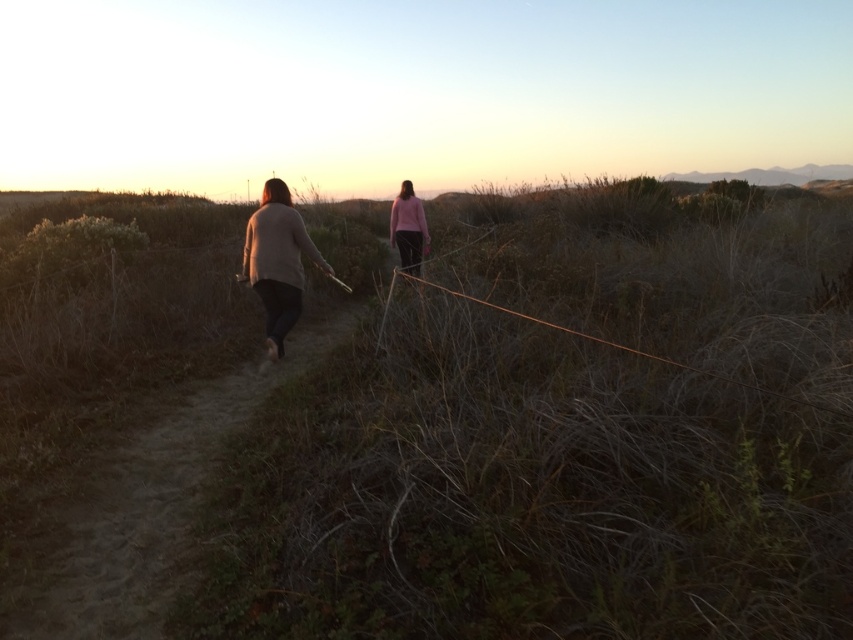
Can you confirm if dirt path at center is positioned below pink matte sweater at center?

Yes, dirt path at center is below pink matte sweater at center.

Who is more forward, (166, 426) or (422, 253)?

Positioned in front is point (166, 426).

Is point (30, 592) farther from camera compared to point (408, 230)?

No, (30, 592) is in front of (408, 230).

Image resolution: width=853 pixels, height=640 pixels. Find the location of `dirt path at center`. dirt path at center is located at coordinates (143, 509).

In the scene shown: Which is more to the left, dirt path at center or light beige sweater at center?

dirt path at center

Between dirt path at center and light beige sweater at center, which one is positioned higher?

light beige sweater at center is above.

This screenshot has width=853, height=640. What do you see at coordinates (143, 509) in the screenshot? I see `dirt path at center` at bounding box center [143, 509].

Locate an element on the screen. dirt path at center is located at coordinates (143, 509).

Who is higher up, brown dry grass at center or dirt path at center?

brown dry grass at center is above.

Is brown dry grass at center closer to the viewer compared to dirt path at center?

Yes, brown dry grass at center is closer to the viewer.

Is point (97, 442) more distant than point (173, 467)?

Yes, it is.

You are a GUI agent. You are given a task and a screenshot of the screen. Output one action in this format:
    pyautogui.click(x=<x>, y=<y>)
    Task: Click on the brown dry grass at center
    
    Given the screenshot: What is the action you would take?
    pyautogui.click(x=450, y=426)